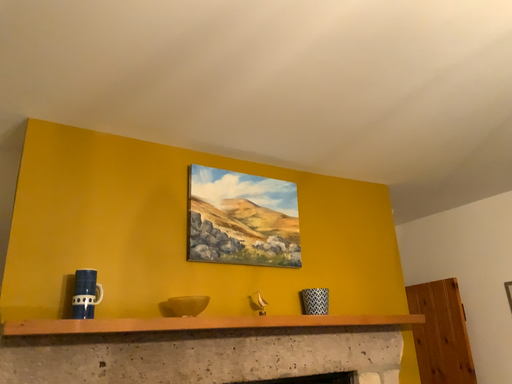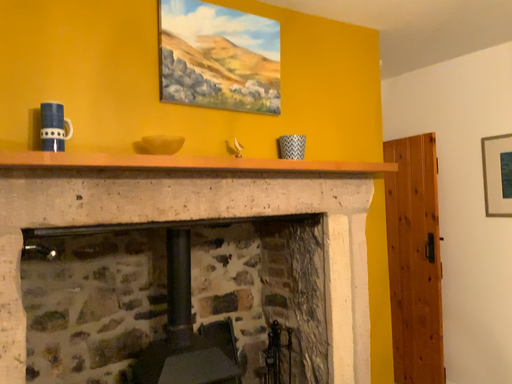
Question: Which way did the camera rotate in the video?

Choices:
 (A) rotated upward
 (B) rotated downward

Answer: (B)